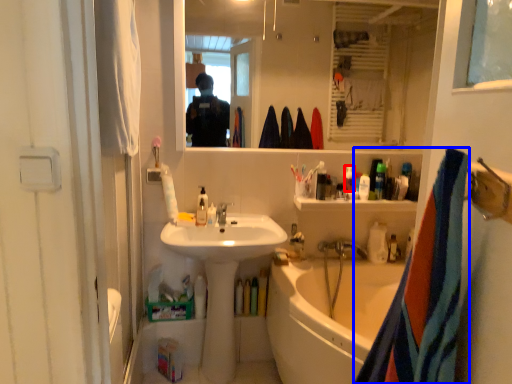
Question: Which of the following is the farthest to the observer, toiletry (highlighted by a red box) or towel/napkin (highlighted by a blue box)?

Choices:
 (A) toiletry
 (B) towel/napkin

Answer: (A)